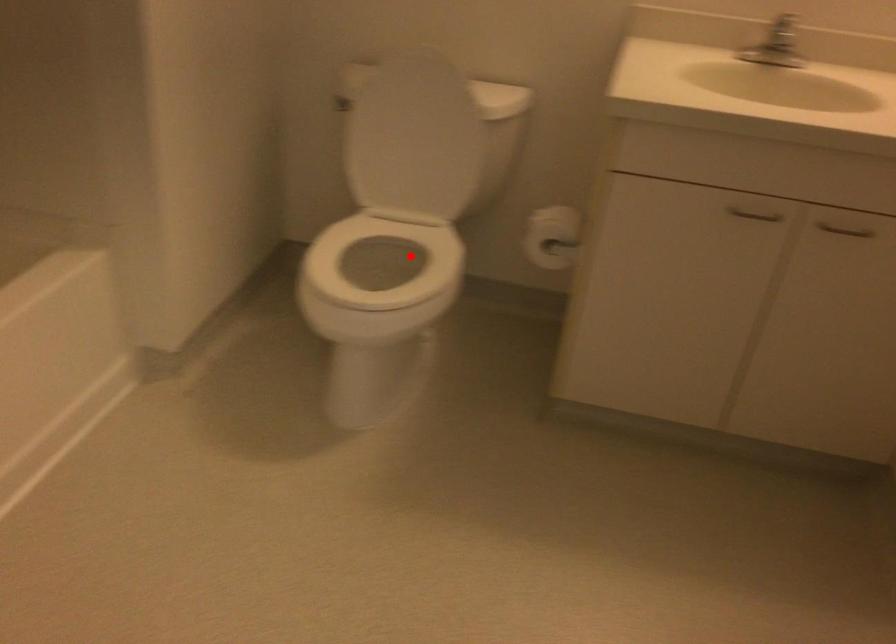
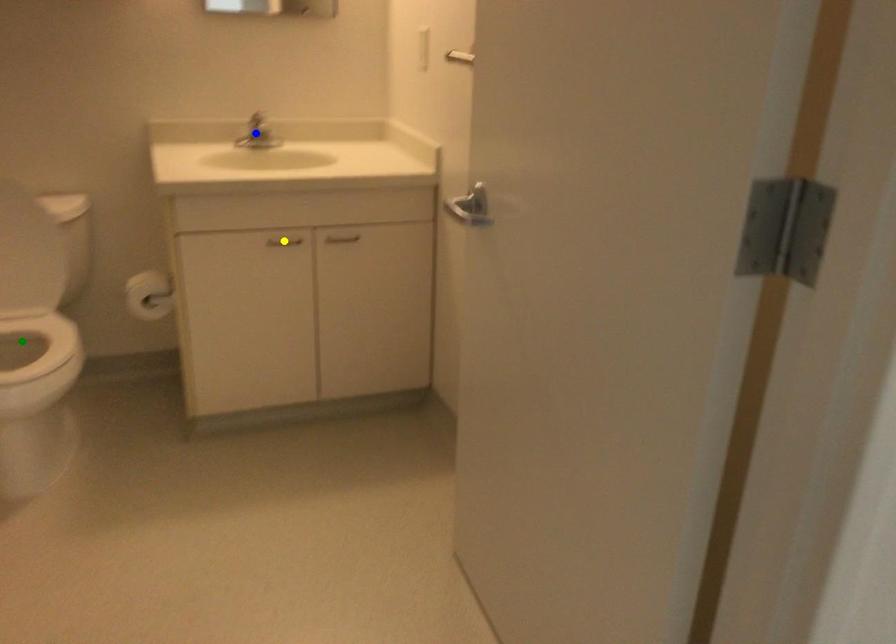
Question: I am providing you with two images of the same scene from different viewpoints. A red point is marked on the first image. You are given multiple points on the second image. In image 2, which mark is for the same physical point as the one in image 1?

Choices:
 (A) yellow point
 (B) green point
 (C) blue point

Answer: (B)